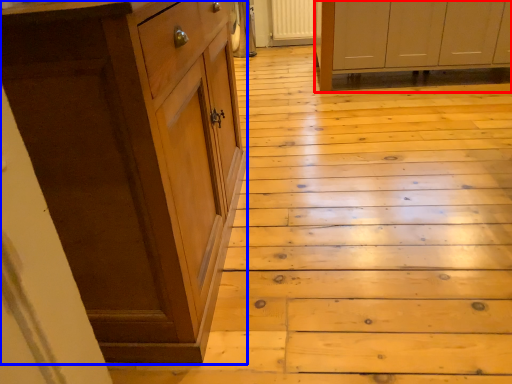
Question: Which object appears farthest to the camera in this image, cabinetry (highlighted by a red box) or cabinetry (highlighted by a blue box)?

Choices:
 (A) cabinetry
 (B) cabinetry

Answer: (A)